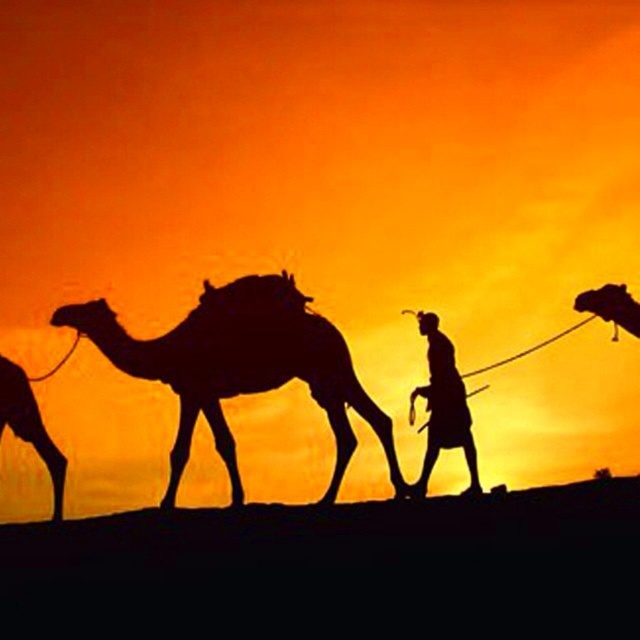
Is silhouette camel at center closer to the viewer compared to silhouette camel at left?

Yes, it is in front of silhouette camel at left.

Locate an element on the screen. silhouette camel at center is located at coordinates (241, 365).

Who is lower down, silhouette camel at left or silhouette camel at right?

Positioned lower is silhouette camel at left.

Does silhouette camel at left have a lesser width compared to silhouette camel at right?

No.

What do you see at coordinates (29, 422) in the screenshot? I see `silhouette camel at left` at bounding box center [29, 422].

Identify the location of silhouette camel at left. This screenshot has height=640, width=640. [29, 422].

Who is higher up, silhouette camel at center or silhouette figure at center?

silhouette camel at center is higher up.

Is point (220, 353) positioned after point (424, 314)?

No.

Where is `silhouette camel at center`? silhouette camel at center is located at coordinates [241, 365].